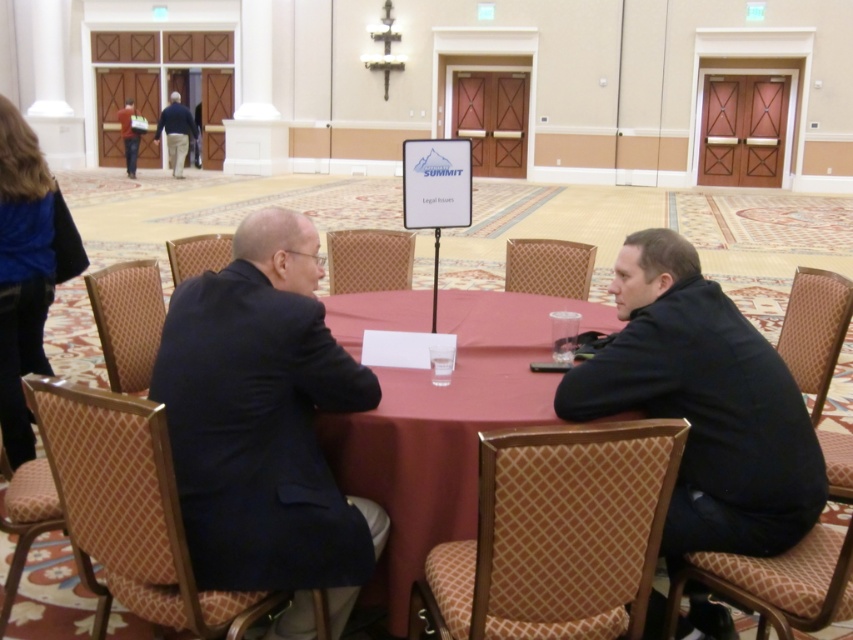
Between point (653, 284) and point (183, 106), which one is positioned behind?

Point (183, 106)

Between black matte jacket at right and dark blue jacket at upper left, which one has more height?

dark blue jacket at upper left is taller.

Find the location of a particular element. This screenshot has width=853, height=640. black matte jacket at right is located at coordinates (704, 403).

Between black matte jacket at right and dark blue shirt at upper left, which one appears on the right side from the viewer's perspective?

black matte jacket at right is more to the right.

Find the location of a particular element. The width and height of the screenshot is (853, 640). black matte jacket at right is located at coordinates (704, 403).

Find the location of a particular element. dark blue jacket at upper left is located at coordinates (x=175, y=132).

Does dark blue jacket at upper left lie behind dark blue shirt at upper left?

No.

Where is `dark blue jacket at upper left`? dark blue jacket at upper left is located at coordinates (175, 132).